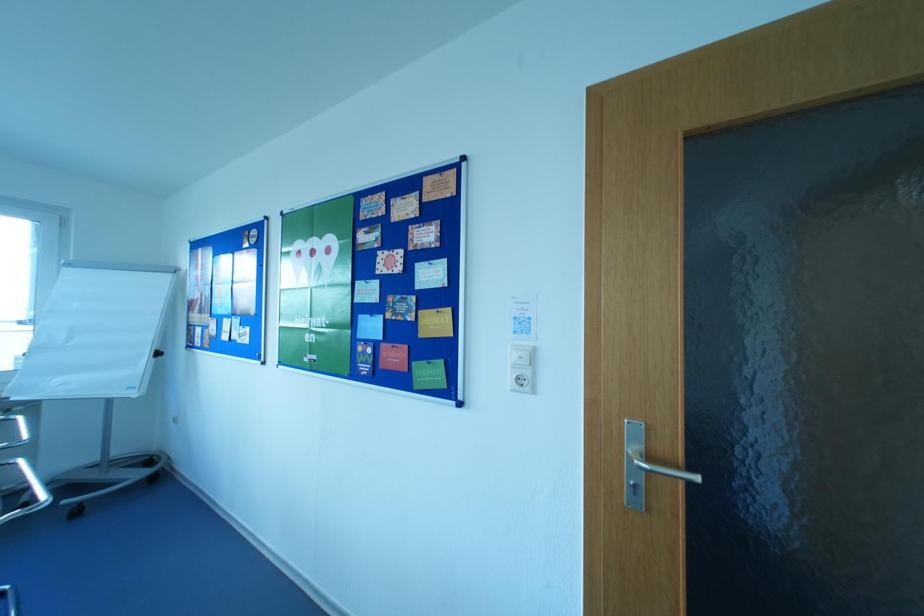
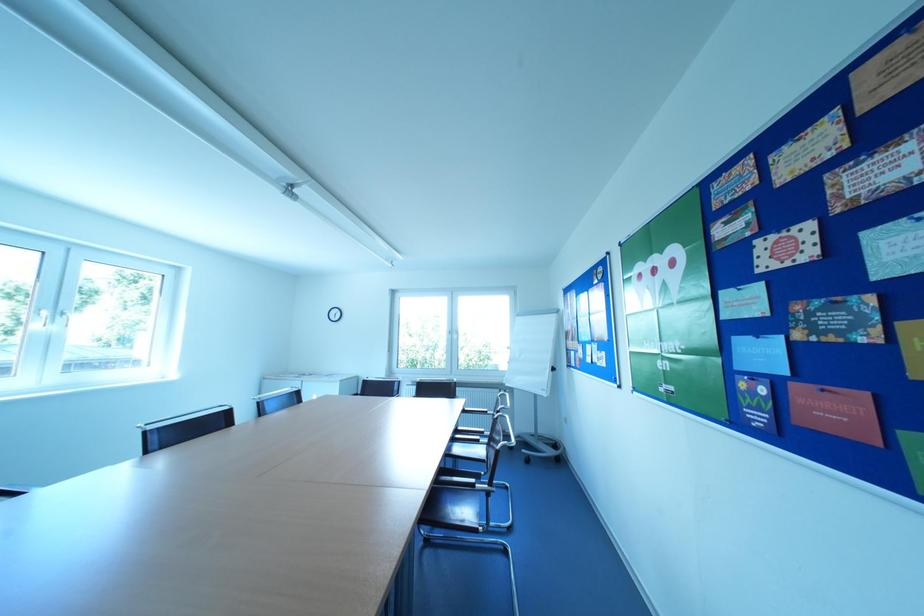
Question: The first image is from the beginning of the video and the second image is from the end. How did the camera likely rotate when shooting the video?

Choices:
 (A) Left
 (B) Right
 (C) Up
 (D) Down

Answer: (A)